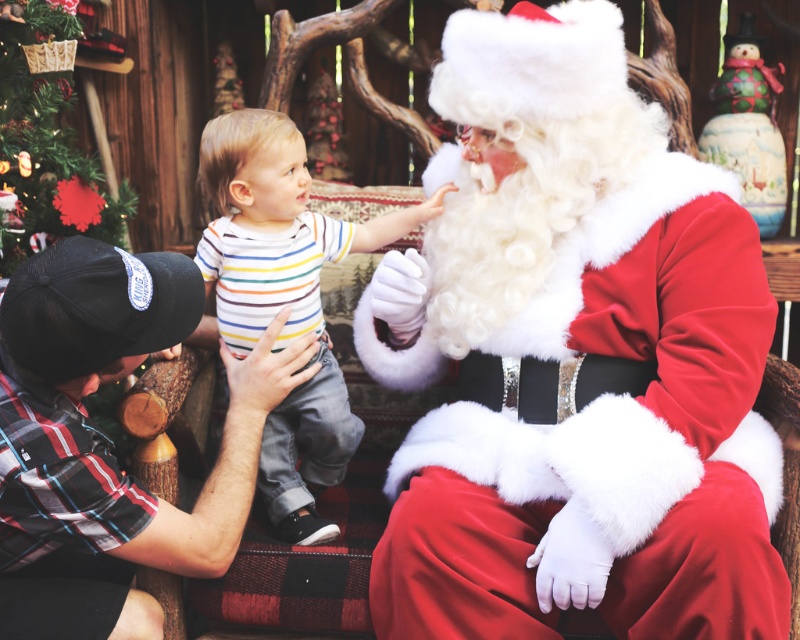
Question: Which of the following is the farthest from the observer?

Choices:
 (A) green matte christmas tree at upper left
 (B) striped cotton shirt at center
 (C) velvet red santa at center

Answer: (A)

Question: Can you confirm if velvet red santa at center is positioned above plaid shirt at lower left?

Choices:
 (A) no
 (B) yes

Answer: (B)

Question: Which object is positioned closest to the green matte christmas tree at upper left?

Choices:
 (A) plaid shirt at lower left
 (B) velvet red santa at center
 (C) striped cotton shirt at center

Answer: (C)

Question: Does plaid shirt at lower left appear under green matte christmas tree at upper left?

Choices:
 (A) yes
 (B) no

Answer: (A)

Question: Which object is closer to the camera taking this photo?

Choices:
 (A) velvet red santa at center
 (B) green matte christmas tree at upper left

Answer: (A)

Question: Is plaid shirt at lower left to the left of striped cotton shirt at center from the viewer's perspective?

Choices:
 (A) yes
 (B) no

Answer: (A)